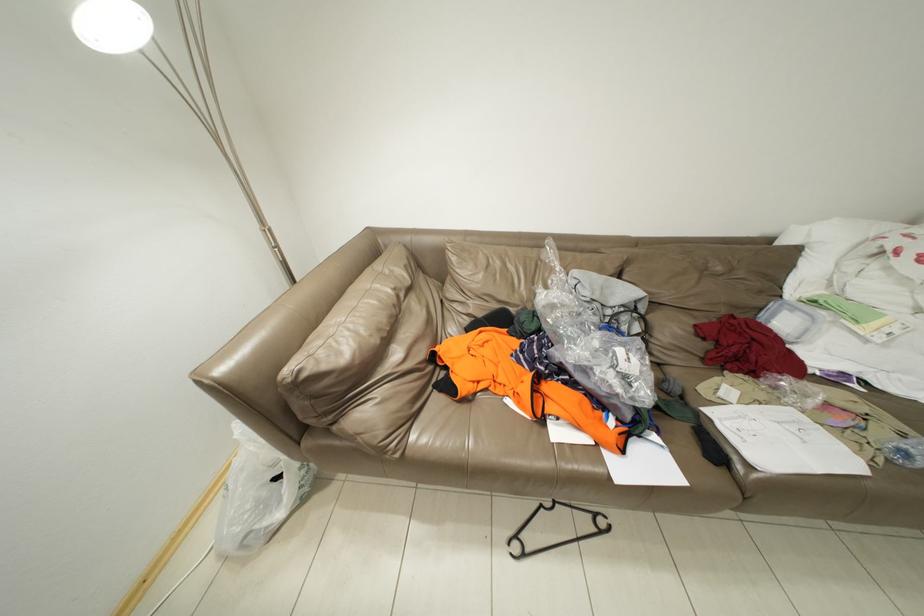
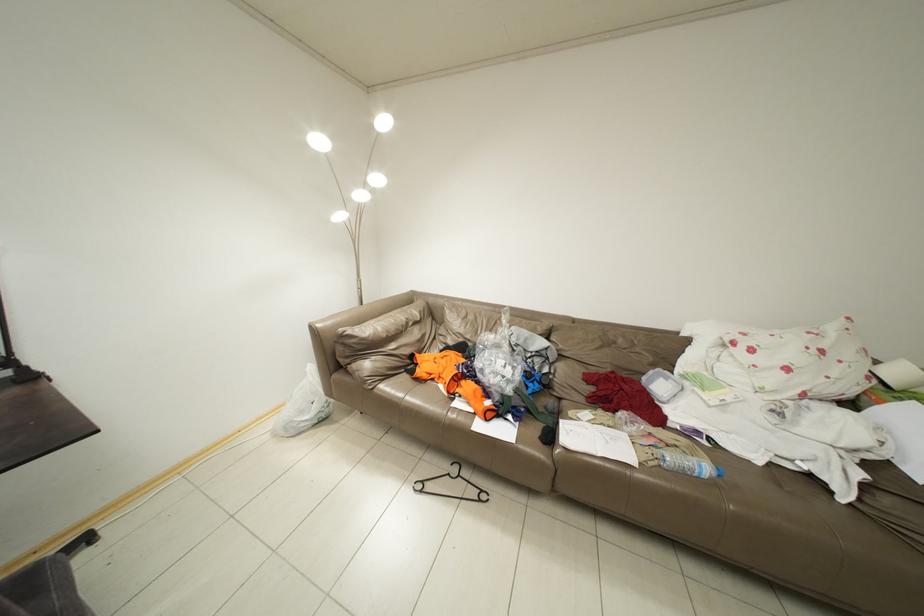
What movement of the cameraman would produce the second image?

The cameraman moved toward right, backward.